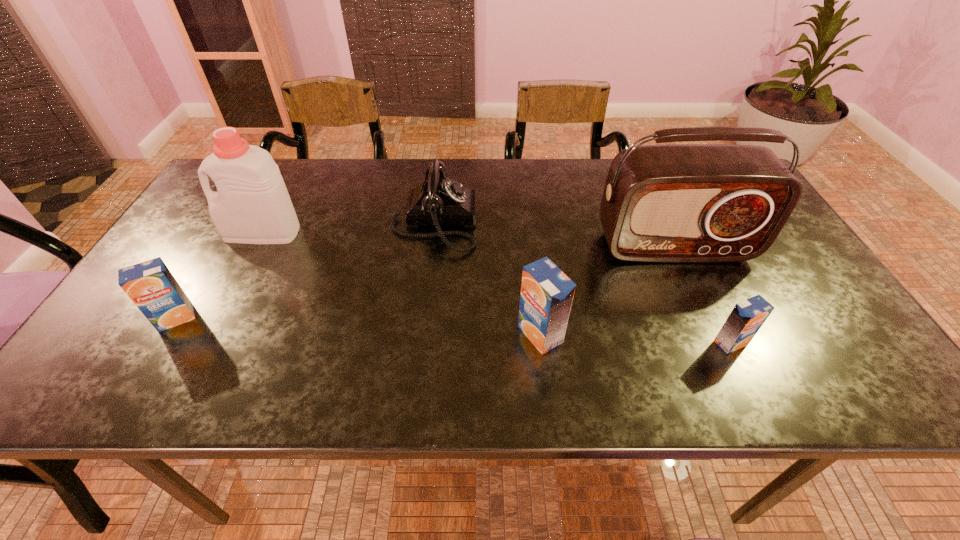
You are a GUI agent. You are given a task and a screenshot of the screen. Output one action in this format:
    pyautogui.click(x=<x>, y=<y>)
    Task: Click on the free space between the third tallest object and the detergent
    The image size is (960, 540).
    Given the screenshot: What is the action you would take?
    pyautogui.click(x=401, y=284)

The image size is (960, 540). Find the location of `vacant area that lies between the detergent and the shortest object`. vacant area that lies between the detergent and the shortest object is located at coordinates (496, 288).

The height and width of the screenshot is (540, 960). Identify the location of free space that is in between the shortest object and the telephone. point(583,282).

What are the coordinates of `empty location between the fourth object from right to left and the second orange_juice from left to right` in the screenshot? It's located at pyautogui.click(x=487, y=278).

Find the location of a particular element. Image resolution: width=960 pixels, height=540 pixels. vacant space that's between the rightmost orange_juice and the fourth object from right to left is located at coordinates (583, 282).

Locate an element on the screen. The image size is (960, 540). object that is the third closest one to the second orange_juice from right to left is located at coordinates (747, 317).

What are the coordinates of `object that stands as the closest to the radio receiver` in the screenshot? It's located at (547, 293).

What are the coordinates of `orange_juice that is the second closest one to the shortest object` in the screenshot? It's located at (151, 286).

Select which orange_juice appears as the second closest to the rightmost orange_juice. Please provide its 2D coordinates. Your answer should be formatted as a tuple, i.e. [(x, y)], where the tuple contains the x and y coordinates of a point satisfying the conditions above.

[(151, 286)]

This screenshot has height=540, width=960. Find the location of `blank space that satisfies the following two spatial constraints: 1. on the front panel of the shortest object; 2. on the left side of the radio receiver`. blank space that satisfies the following two spatial constraints: 1. on the front panel of the shortest object; 2. on the left side of the radio receiver is located at coordinates (718, 343).